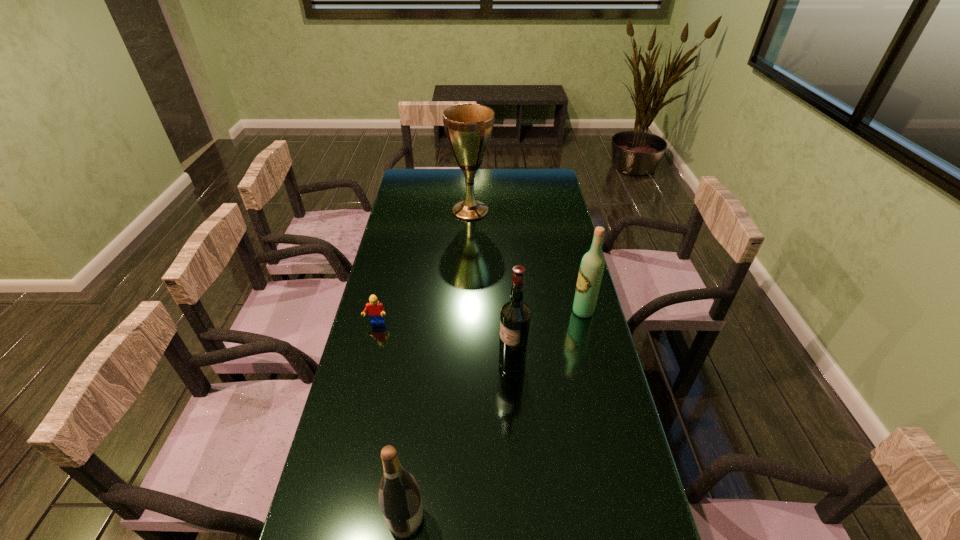
Where is `trophy cup`? This screenshot has width=960, height=540. trophy cup is located at coordinates (468, 127).

Identify the location of the second nearest object. (515, 315).

Locate an element on the screen. The height and width of the screenshot is (540, 960). the second wine bottle from right to left is located at coordinates (515, 315).

Find the location of a particular element. The width and height of the screenshot is (960, 540). the farthest wine bottle is located at coordinates (591, 269).

Locate an element on the screen. the rightmost wine bottle is located at coordinates (591, 269).

You are a GUI agent. You are given a task and a screenshot of the screen. Output one action in this format:
    pyautogui.click(x=<x>, y=<y>)
    Task: Click on the nearest object
    
    Given the screenshot: What is the action you would take?
    pyautogui.click(x=399, y=496)

Identify the location of the nearest wine bottle. This screenshot has height=540, width=960. (399, 496).

This screenshot has width=960, height=540. What are the coordinates of `the leftmost object` in the screenshot? It's located at (375, 309).

Identify the location of the shortest object. The height and width of the screenshot is (540, 960). (375, 309).

You are a GUI agent. You are given a task and a screenshot of the screen. Output one action in this format:
    pyautogui.click(x=<x>, y=<y>)
    Task: Click on the vacant space located on the right of the trophy cup
    The image size is (960, 540).
    Given the screenshot: What is the action you would take?
    pyautogui.click(x=504, y=211)